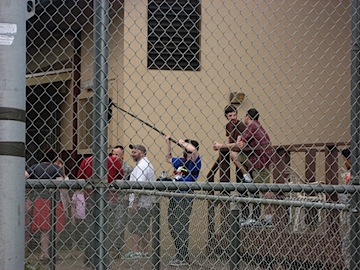
Find the location of a particular element. The image size is (360, 270). doors is located at coordinates (39, 154).